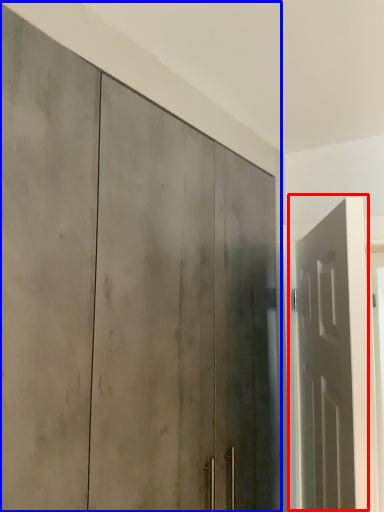
Question: Which object appears closest to the camera in this image, door (highlighted by a red box) or door (highlighted by a blue box)?

Choices:
 (A) door
 (B) door

Answer: (B)